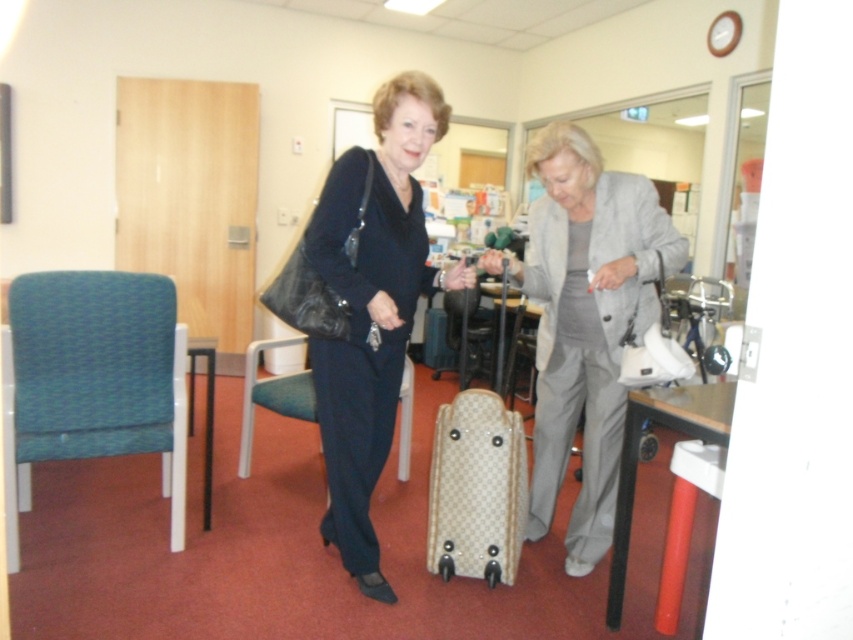
Which of these two, light gray suit at center or matte black dress at center, stands shorter?

Standing shorter between the two is light gray suit at center.

Who is taller, light gray suit at center or matte black dress at center?

matte black dress at center is taller.

The height and width of the screenshot is (640, 853). Describe the element at coordinates (585, 321) in the screenshot. I see `light gray suit at center` at that location.

The width and height of the screenshot is (853, 640). What are the coordinates of `light gray suit at center` in the screenshot? It's located at (585, 321).

Between teal fabric chair at left and beige textured suitcase at center, which one appears on the right side from the viewer's perspective?

beige textured suitcase at center is more to the right.

Can you confirm if teal fabric chair at left is shorter than beige textured suitcase at center?

No.

Is point (70, 372) positioned after point (454, 467)?

Yes, it is behind point (454, 467).

You are a GUI agent. You are given a task and a screenshot of the screen. Output one action in this format:
    pyautogui.click(x=<x>, y=<y>)
    Task: Click on the teal fabric chair at left
    Image resolution: width=853 pixels, height=640 pixels.
    Given the screenshot: What is the action you would take?
    pyautogui.click(x=93, y=380)

Can you confirm if light gray suit at center is positioned to the right of teal fabric chair at left?

Correct, you'll find light gray suit at center to the right of teal fabric chair at left.

Between point (633, 262) and point (125, 432), which one is positioned in front?

Positioned in front is point (633, 262).

Image resolution: width=853 pixels, height=640 pixels. Find the location of `light gray suit at center`. light gray suit at center is located at coordinates click(585, 321).